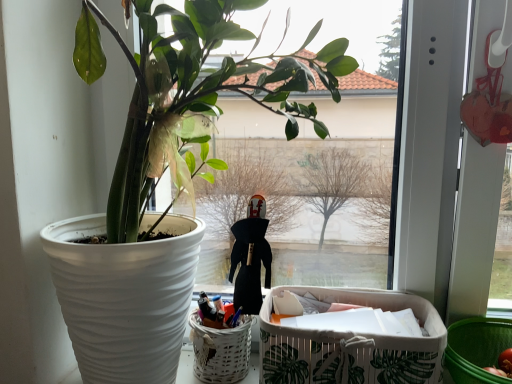
Question: Are white wicker basket at lower center and green plastic basket at lower right located far from each other?

Choices:
 (A) no
 (B) yes

Answer: (A)

Question: Are white wicker basket at lower center and green plastic basket at lower right beside each other?

Choices:
 (A) no
 (B) yes

Answer: (A)

Question: Is white wicker basket at lower center positioned beyond the bounds of green plastic basket at lower right?

Choices:
 (A) no
 (B) yes

Answer: (B)

Question: Is white wicker basket at lower center behind green plastic basket at lower right?

Choices:
 (A) no
 (B) yes

Answer: (B)

Question: Is white wicker basket at lower center positioned in front of green plastic basket at lower right?

Choices:
 (A) yes
 (B) no

Answer: (B)

Question: Does white wicker basket at lower center have a larger size compared to green plastic basket at lower right?

Choices:
 (A) yes
 (B) no

Answer: (B)

Question: Is white wicker basket at lower center surrounded by green matte plant at left?

Choices:
 (A) yes
 (B) no

Answer: (A)

Question: From the image's perspective, is green matte plant at left under white wicker basket at lower center?

Choices:
 (A) yes
 (B) no

Answer: (B)

Question: Considering the relative positions of green matte plant at left and white wicker basket at lower center in the image provided, is green matte plant at left to the left of white wicker basket at lower center from the viewer's perspective?

Choices:
 (A) no
 (B) yes

Answer: (B)

Question: Does green matte plant at left have a greater width compared to white wicker basket at lower center?

Choices:
 (A) yes
 (B) no

Answer: (A)

Question: Is green matte plant at left bigger than white wicker basket at lower center?

Choices:
 (A) no
 (B) yes

Answer: (B)

Question: From a real-world perspective, is green matte plant at left located beneath white wicker basket at lower center?

Choices:
 (A) yes
 (B) no

Answer: (B)

Question: Is green leaf-patterned fabric basket at lower right taller than green plastic basket at lower right?

Choices:
 (A) no
 (B) yes

Answer: (B)